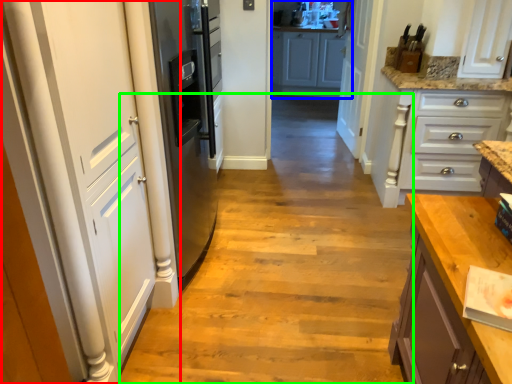
Question: Estimate the real-world distances between objects in this image. Which object is closer to door (highlighted by a red box), cabinetry (highlighted by a blue box) or path (highlighted by a green box)?

Choices:
 (A) cabinetry
 (B) path

Answer: (B)